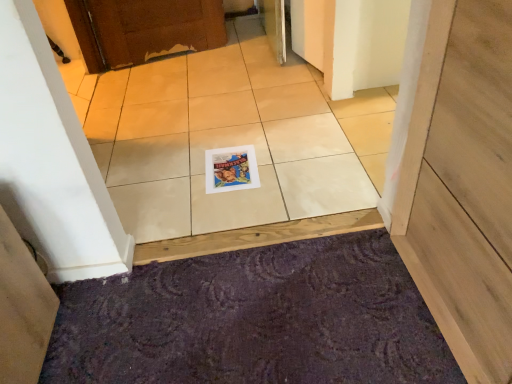
Question: Does matte paper magazine at center have a lesser height compared to white glossy tile at center?

Choices:
 (A) no
 (B) yes

Answer: (A)

Question: Is matte paper magazine at center directly adjacent to white glossy tile at center?

Choices:
 (A) yes
 (B) no

Answer: (B)

Question: From a real-world perspective, is matte paper magazine at center over white glossy tile at center?

Choices:
 (A) no
 (B) yes

Answer: (A)

Question: Is matte paper magazine at center facing towards white glossy tile at center?

Choices:
 (A) no
 (B) yes

Answer: (B)

Question: Are matte paper magazine at center and white glossy tile at center far apart?

Choices:
 (A) no
 (B) yes

Answer: (A)

Question: From a real-world perspective, is matte paper magazine at center physically located above or below purple textured doormat at lower center?

Choices:
 (A) below
 (B) above

Answer: (B)

Question: Is matte paper magazine at center spatially inside purple textured doormat at lower center, or outside of it?

Choices:
 (A) inside
 (B) outside

Answer: (B)

Question: Is matte paper magazine at center taller or shorter than purple textured doormat at lower center?

Choices:
 (A) tall
 (B) short

Answer: (B)

Question: Is matte paper magazine at center bigger or smaller than purple textured doormat at lower center?

Choices:
 (A) big
 (B) small

Answer: (B)

Question: Is point (259, 380) closer or farther from the camera than point (166, 203)?

Choices:
 (A) farther
 (B) closer

Answer: (B)

Question: In terms of size, does purple textured doormat at lower center appear bigger or smaller than white glossy tile at center?

Choices:
 (A) small
 (B) big

Answer: (A)

Question: From a real-world perspective, is purple textured doormat at lower center physically located above or below white glossy tile at center?

Choices:
 (A) below
 (B) above

Answer: (A)

Question: Is purple textured doormat at lower center to the left or to the right of white glossy tile at center in the image?

Choices:
 (A) left
 (B) right

Answer: (B)

Question: From the image's perspective, is white glossy tile at center positioned above or below matte paper magazine at center?

Choices:
 (A) above
 (B) below

Answer: (A)

Question: Choose the correct answer: Is white glossy tile at center inside matte paper magazine at center or outside it?

Choices:
 (A) outside
 (B) inside

Answer: (A)